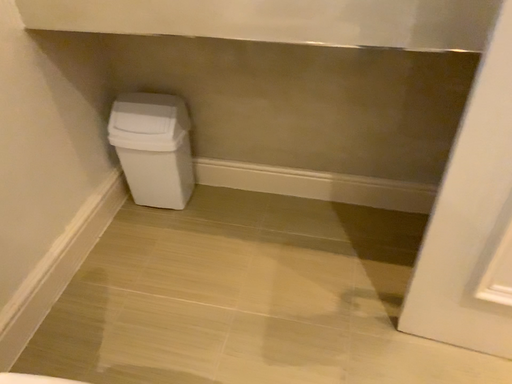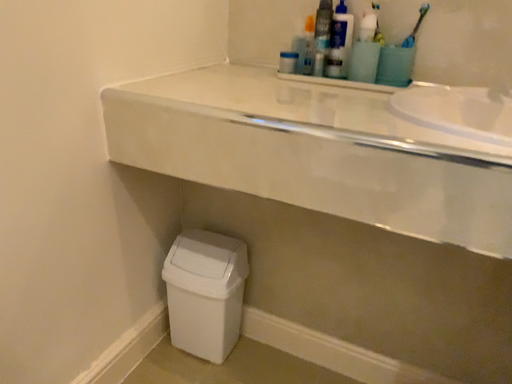
Question: How did the camera likely rotate when shooting the video?

Choices:
 (A) rotated downward
 (B) rotated upward

Answer: (B)